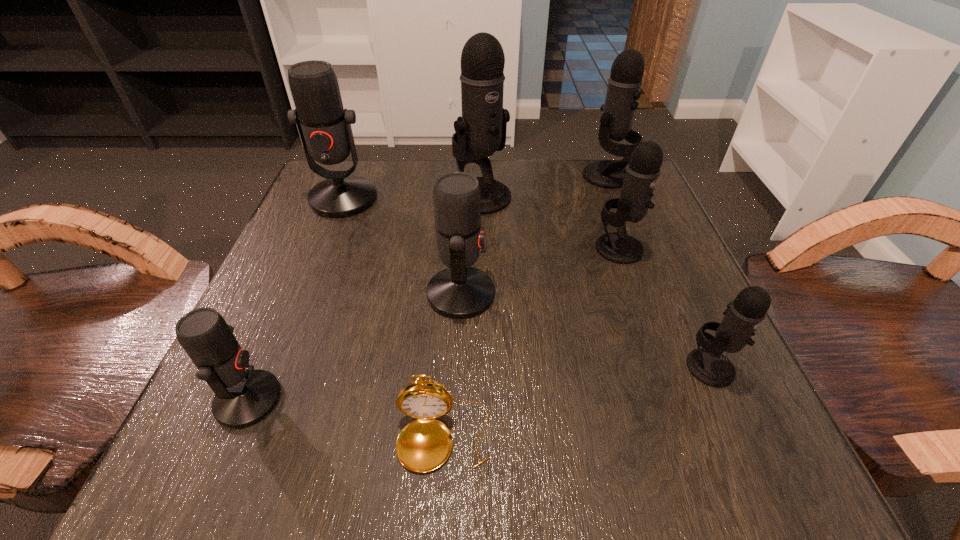
Where is `the tallest microphone`? the tallest microphone is located at coordinates (481, 131).

Identify the location of the tallest object. (481, 131).

Find the location of a particular element. Image resolution: width=960 pixels, height=540 pixels. the second biggest black microphone is located at coordinates (625, 81).

Identify the location of the farthest red microphone. click(324, 126).

This screenshot has height=540, width=960. Identify the location of the rightmost red microphone. (x=460, y=291).

At what (x,y) coordinates should I click in order to perform the action: click on the fourth nearest object. Please return your answer as a coordinate pair (x, y). This screenshot has width=960, height=540. Looking at the image, I should click on (460, 291).

Identify the location of the fourth farthest microphone. This screenshot has height=540, width=960. (641, 174).

The image size is (960, 540). In order to click on the third biggest black microphone in this screenshot , I will do `click(641, 174)`.

Where is `the smallest black microphone`? the smallest black microphone is located at coordinates (708, 365).

Image resolution: width=960 pixels, height=540 pixels. Find the location of `the smallest red microphone`. the smallest red microphone is located at coordinates (243, 396).